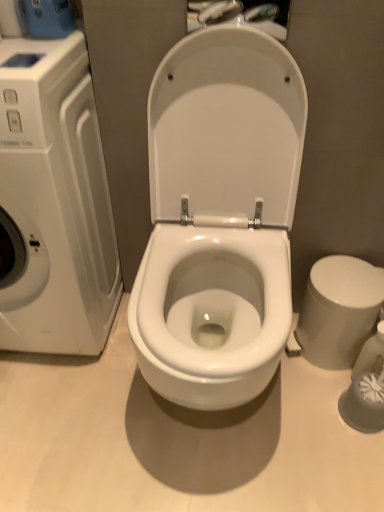
Describe the element at coordinates (54, 202) in the screenshot. Image resolution: width=384 pixels, height=512 pixels. I see `white glossy washing machine at left` at that location.

Locate an element on the screen. This screenshot has width=384, height=512. white glossy washing machine at left is located at coordinates (54, 202).

Identify the location of white glossy bidet at right. (338, 310).

Describe the element at coordinates (338, 310) in the screenshot. I see `white glossy bidet at right` at that location.

Where is `white glossy washing machine at left`? Image resolution: width=384 pixels, height=512 pixels. white glossy washing machine at left is located at coordinates (54, 202).

Which object is positioned more to the right, white glossy bidet at right or white glossy washing machine at left?

white glossy bidet at right.

Relative to white glossy washing machine at left, is white glossy bidet at right in front or behind?

Visually, white glossy bidet at right is located behind white glossy washing machine at left.

Which is less distant, (353,280) or (9,343)?

Clearly, point (353,280) is closer to the camera than point (9,343).

In the scene shown: From the image's perspective, does white glossy bidet at right appear higher than white glossy washing machine at left?

Incorrect, from the image's perspective, white glossy bidet at right is lower than white glossy washing machine at left.

From a real-world perspective, between white glossy bidet at right and white glossy washing machine at left, who is vertically higher?

From a 3D spatial view, white glossy washing machine at left is above.

Is white glossy bidet at right wider or thinner than white glossy washing machine at left?

Considering their sizes, white glossy bidet at right looks slimmer than white glossy washing machine at left.

Who is taller, white glossy bidet at right or white glossy washing machine at left?

Standing taller between the two is white glossy washing machine at left.

Which of these two, white glossy bidet at right or white glossy washing machine at left, is bigger?

white glossy washing machine at left.

Consider the image. Is white glossy washing machine at left inside white glossy bidet at right?

Definitely not — white glossy washing machine at left is not inside white glossy bidet at right.

Is white glossy bidet at right positioned far away from white glossy washing machine at left?

No.

Is white glossy bidet at right looking in the opposite direction of white glossy washing machine at left?

No, white glossy washing machine at left is not at the back of white glossy bidet at right.

The height and width of the screenshot is (512, 384). In order to click on washing machine on the left of white glossy bidet at right in this screenshot , I will do `click(54, 202)`.

Based on their positions, is white glossy washing machine at left located to the left or right of white glossy bidet at right?

white glossy washing machine at left is to the left of white glossy bidet at right.

Which object is further away from the camera taking this photo, white glossy washing machine at left or white glossy bidet at right?

white glossy bidet at right is further away from the camera.

Between point (99, 168) and point (379, 281), which one is positioned in front?

The point (99, 168) is more forward.

From the image's perspective, would you say white glossy washing machine at left is positioned over white glossy bidet at right?

Yes, from the image's perspective, white glossy washing machine at left is above white glossy bidet at right.

From a real-world perspective, who is located lower, white glossy washing machine at left or white glossy bidet at right?

white glossy bidet at right.

Which of these two, white glossy washing machine at left or white glossy bidet at right, is thinner?

With smaller width is white glossy bidet at right.

Does white glossy washing machine at left have a greater height compared to white glossy bidet at right?

Correct, white glossy washing machine at left is much taller as white glossy bidet at right.

Is white glossy washing machine at left bigger than white glossy bidet at right?

Yes, white glossy washing machine at left is bigger than white glossy bidet at right.

Is white glossy washing machine at left not inside white glossy bidet at right?

white glossy washing machine at left is positioned outside white glossy bidet at right.

Can you see white glossy washing machine at left touching white glossy bidet at right?

No.

Is white glossy washing machine at left oriented towards white glossy bidet at right?

No, white glossy washing machine at left does not turn towards white glossy bidet at right.

Can you tell me how much white glossy washing machine at left and white glossy bidet at right differ in facing direction?

white glossy washing machine at left and white glossy bidet at right are facing 0.000533 degrees away from each other.

How distant is white glossy washing machine at left from white glossy bidet at right?

white glossy washing machine at left and white glossy bidet at right are 27.86 inches apart from each other.

Locate an element on the screen. washing machine that appears above the white glossy bidet at right (from the image's perspective) is located at coordinates (54, 202).

This screenshot has width=384, height=512. In order to click on washing machine positioned vertically above the white glossy bidet at right (from a real-world perspective) in this screenshot , I will do `click(54, 202)`.

Where is `washing machine in front of the white glossy bidet at right`? Image resolution: width=384 pixels, height=512 pixels. washing machine in front of the white glossy bidet at right is located at coordinates (54, 202).